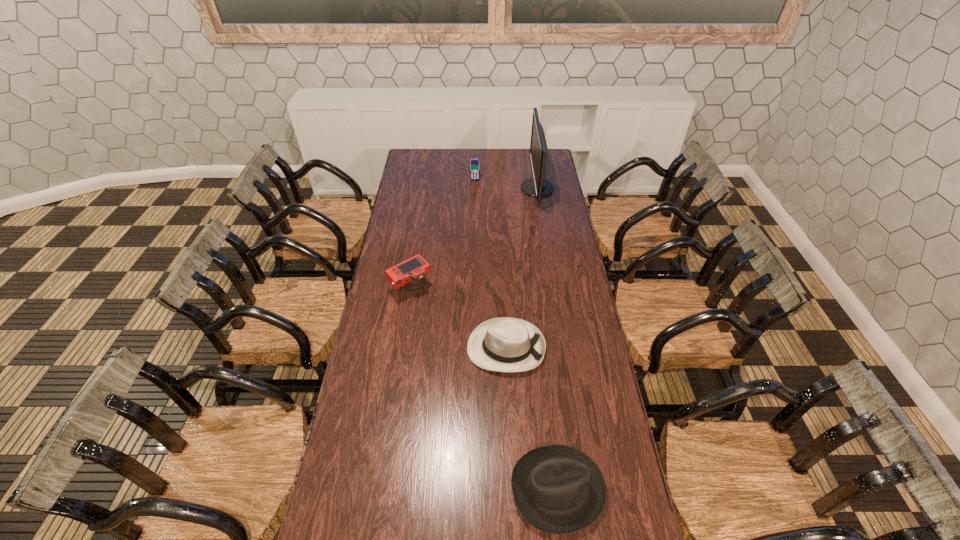
Find the location of `free space between the third farthest object and the nearest object`. free space between the third farthest object and the nearest object is located at coordinates (485, 388).

The height and width of the screenshot is (540, 960). In order to click on free space that is in between the fourth farthest object and the monitor in this screenshot , I will do `click(521, 268)`.

Locate an element on the screen. The width and height of the screenshot is (960, 540). empty space between the monitor and the nearest object is located at coordinates (547, 339).

Select which object appears as the second closest to the tallest object. Please provide its 2D coordinates. Your answer should be formatted as a tuple, i.e. [(x, y)], where the tuple contains the x and y coordinates of a point satisfying the conditions above.

[(410, 273)]

This screenshot has height=540, width=960. Find the location of `object that is the fourth closest one to the cellular telephone`. object that is the fourth closest one to the cellular telephone is located at coordinates (557, 489).

Where is `vacant position in the image that satisfies the following two spatial constraints: 1. on the screen side of the monitor; 2. on the front side of the camera`? The width and height of the screenshot is (960, 540). vacant position in the image that satisfies the following two spatial constraints: 1. on the screen side of the monitor; 2. on the front side of the camera is located at coordinates (553, 288).

Image resolution: width=960 pixels, height=540 pixels. I want to click on free spot that satisfies the following two spatial constraints: 1. on the front-facing side of the cellular telephone; 2. on the left side of the nearest object, so click(x=470, y=489).